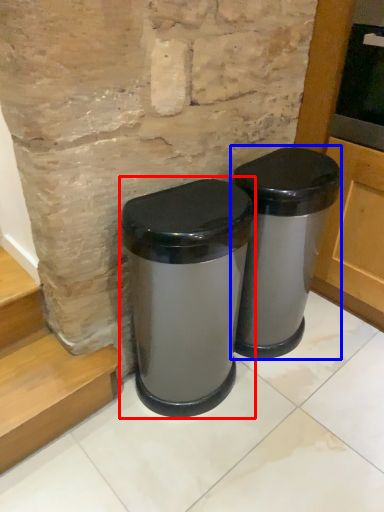
Question: Which of the following is the closest to the observer, waste container (highlighted by a red box) or waste container (highlighted by a blue box)?

Choices:
 (A) waste container
 (B) waste container

Answer: (A)